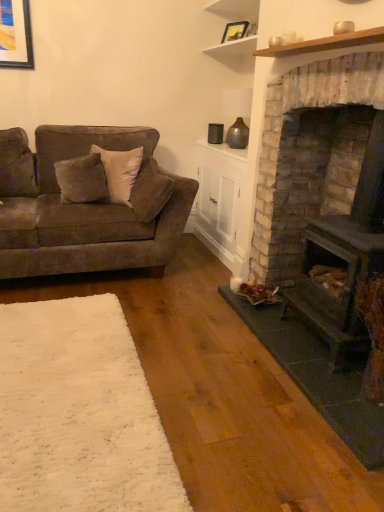
Locate an element on the screen. This screenshot has width=384, height=512. white wood shelf at upper center is located at coordinates (235, 20).

What are the coordinates of `velvet brown couch at left` in the screenshot? It's located at (79, 208).

Is white soft rug at lower left far away from velvet gray pillow at left?

Indeed, white soft rug at lower left is not near velvet gray pillow at left.

Is white soft rug at lower left to the right of velvet gray pillow at left from the viewer's perspective?

Correct, you'll find white soft rug at lower left to the right of velvet gray pillow at left.

Does white soft rug at lower left have a smaller size compared to velvet gray pillow at left?

Correct, white soft rug at lower left occupies less space than velvet gray pillow at left.

What's the angular difference between white soft rug at lower left and velvet gray pillow at left's facing directions?

They differ by 55 degrees in their facing directions.

From a real-world perspective, is white wood shelf at upper center physically located above or below velvet gray pillow at left?

In terms of real-world spatial position, white wood shelf at upper center is above velvet gray pillow at left.

Is white wood shelf at upper center completely or partially outside of velvet gray pillow at left?

A: Yes, white wood shelf at upper center is located beyond the bounds of velvet gray pillow at left.

Considering the relative sizes of white wood shelf at upper center and velvet gray pillow at left in the image provided, is white wood shelf at upper center taller than velvet gray pillow at left?

Yes.

Is point (223, 48) farther from viewer compared to point (67, 201)?

Yes, point (223, 48) is farther from viewer.

Does brick textured wood burning stove at right have a greater height compared to white soft rug at lower left?

Yes, brick textured wood burning stove at right is taller than white soft rug at lower left.

Does point (379, 133) lie behind point (47, 343)?

Yes, it is.

Is brick textured wood burning stove at right positioned with its back to white soft rug at lower left?

No, brick textured wood burning stove at right is not facing the opposite direction of white soft rug at lower left.

From the picture: Can you confirm if brick textured wood burning stove at right is smaller than white soft rug at lower left?

Actually, brick textured wood burning stove at right might be larger than white soft rug at lower left.

Is the surface of white soft rug at lower left in direct contact with matte black picture frame at upper center?

There is a gap between white soft rug at lower left and matte black picture frame at upper center.

From a real-world perspective, is white soft rug at lower left on top of matte black picture frame at upper center?

No, from a real-world perspective, white soft rug at lower left is not above matte black picture frame at upper center.

Does white soft rug at lower left have a lesser height compared to matte black picture frame at upper center?

Yes.

Considering the positions of point (176, 484) and point (226, 25), is point (176, 484) closer or farther from the camera than point (226, 25)?

Point (176, 484) is positioned closer to the camera compared to point (226, 25).

Is brick textured wood burning stove at right aimed at velvet gray pillow at left?

No, brick textured wood burning stove at right is not aimed at velvet gray pillow at left.

Is point (371, 205) closer to camera compared to point (98, 193)?

Yes, it is in front of point (98, 193).

From a real-world perspective, between brick textured wood burning stove at right and velvet gray pillow at left, who is vertically lower?

brick textured wood burning stove at right is physically lower.

From the image's perspective, which one is positioned lower, brick textured wood burning stove at right or velvet gray pillow at left?

brick textured wood burning stove at right, from the image's perspective.

The image size is (384, 512). Identify the location of studio couch below the matte black picture frame at upper center (from the image's perspective). (79, 208).

In the scene shown: Is velvet brown couch at left in contact with matte black picture frame at upper center?

They are not placed beside each other.

Considering the positions of objects velvet brown couch at left and matte black picture frame at upper center in the image provided, who is in front, velvet brown couch at left or matte black picture frame at upper center?

velvet brown couch at left is closer to the camera.

Is matte black picture frame at upper center a part of velvet brown couch at left?

No.

Is velvet gray pillow at left to the left or to the right of white soft rug at lower left in the image?

Based on their positions, velvet gray pillow at left is located to the left of white soft rug at lower left.

Which is behind, point (65, 172) or point (13, 390)?

The point (65, 172) is farther from the camera.

From a real-world perspective, is velvet gray pillow at left physically below white soft rug at lower left?

No, from a real-world perspective, velvet gray pillow at left is not under white soft rug at lower left.

Considering the sizes of objects velvet gray pillow at left and white soft rug at lower left in the image provided, who is shorter, velvet gray pillow at left or white soft rug at lower left?

white soft rug at lower left.

Image resolution: width=384 pixels, height=512 pixels. Identify the location of pillow located above the white soft rug at lower left (from a real-world perspective). (82, 179).

Where is `pillow that is on the left side of white wood shelf at upper center`? This screenshot has width=384, height=512. pillow that is on the left side of white wood shelf at upper center is located at coordinates (82, 179).

From the image, which object appears to be nearer to velvet brown couch at left, matte black picture frame at upper center or velvet gray pillow at left?

velvet gray pillow at left.

Based on their spatial positions, is velvet brown couch at left or matte black picture frame at upper center closer to white wood shelf at upper center?

Among the two, matte black picture frame at upper center is located nearer to white wood shelf at upper center.

Looking at the image, which one is located further to velvet brown couch at left, brick textured wood burning stove at right or white wood shelf at upper center?

white wood shelf at upper center.

Considering their positions, is brick textured wood burning stove at right positioned closer to white soft rug at lower left than velvet gray pillow at left?

The object closer to white soft rug at lower left is brick textured wood burning stove at right.

Considering their positions, is velvet gray pillow at left positioned closer to white wood shelf at upper center than white soft rug at lower left?

The object closer to white wood shelf at upper center is velvet gray pillow at left.

From the picture: Considering their positions, is white wood shelf at upper center positioned closer to velvet gray pillow at left than white soft rug at lower left?

white soft rug at lower left.

Looking at the image, which one is located closer to velvet brown couch at left, matte black picture frame at upper center or brick textured wood burning stove at right?

Based on the image, brick textured wood burning stove at right appears to be nearer to velvet brown couch at left.

Which object lies further to the anchor point matte black picture frame at upper center, white soft rug at lower left or white wood shelf at upper center?

white soft rug at lower left is further to matte black picture frame at upper center.

This screenshot has width=384, height=512. Identify the location of wood burning stove positioned between white soft rug at lower left and velvet gray pillow at left from near to far. (343, 258).

The width and height of the screenshot is (384, 512). What are the coordinates of `picture frame that lies between white wood shelf at upper center and brick textured wood burning stove at right from top to bottom` in the screenshot? It's located at (234, 31).

Find the location of `pillow between white wood shelf at upper center and velvet brown couch at left in the up-down direction`. pillow between white wood shelf at upper center and velvet brown couch at left in the up-down direction is located at coordinates (82, 179).

This screenshot has width=384, height=512. What are the coordinates of `picture frame between white wood shelf at upper center and velvet brown couch at left from top to bottom` in the screenshot? It's located at (234, 31).